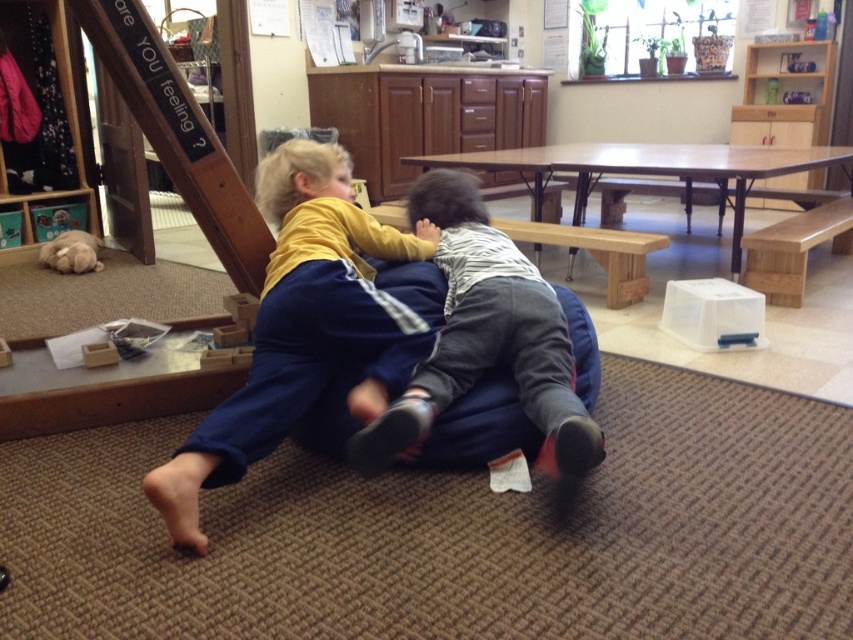
Between matte yellow shirt at center and striped cotton shirt at center, which one appears on the left side from the viewer's perspective?

matte yellow shirt at center is more to the left.

In the scene shown: Is matte yellow shirt at center in front of striped cotton shirt at center?

Yes, matte yellow shirt at center is in front of striped cotton shirt at center.

The height and width of the screenshot is (640, 853). Describe the element at coordinates (300, 326) in the screenshot. I see `matte yellow shirt at center` at that location.

Where is `matte yellow shirt at center`? The height and width of the screenshot is (640, 853). matte yellow shirt at center is located at coordinates (300, 326).